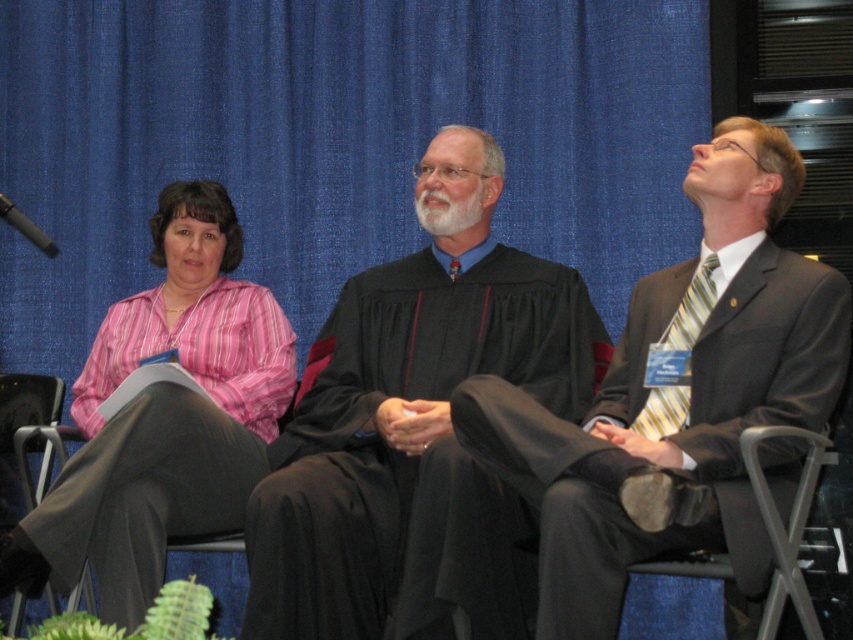
Locate an element on the screen. This screenshot has height=640, width=853. pink striped shirt at center is located at coordinates (163, 417).

Does pink striped shirt at center have a lesser width compared to leather seat at lower right?

No.

Find the location of a particular element. pink striped shirt at center is located at coordinates (163, 417).

The image size is (853, 640). In order to click on pink striped shirt at center in this screenshot , I will do `click(163, 417)`.

Looking at this image, does black matte robe at center have a greater width compared to black plastic microphone at upper left?

Correct, the width of black matte robe at center exceeds that of black plastic microphone at upper left.

Which is more to the right, black matte robe at center or black plastic microphone at upper left?

From the viewer's perspective, black matte robe at center appears more on the right side.

Is point (387, 620) farther from camera compared to point (30, 227)?

Yes, point (387, 620) is behind point (30, 227).

Where is `black matte robe at center`? black matte robe at center is located at coordinates (410, 449).

Is black matte robe at center smaller than matte black robe at center?

Actually, black matte robe at center might be larger than matte black robe at center.

Image resolution: width=853 pixels, height=640 pixels. Identify the location of black matte robe at center. click(x=410, y=449).

Does point (460, 326) lie behind point (676, 531)?

Yes, point (460, 326) is farther from viewer.

Identify the location of black matte robe at center. (410, 449).